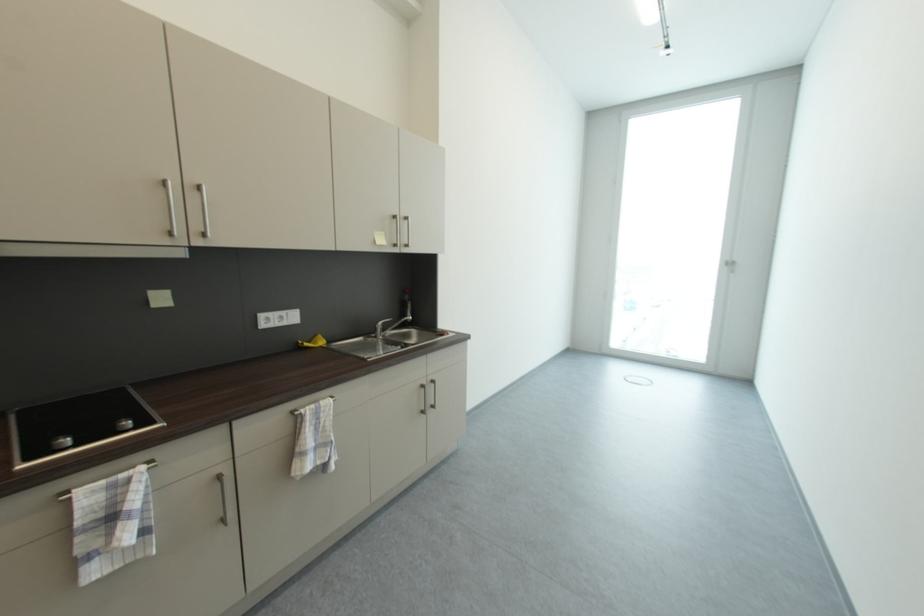
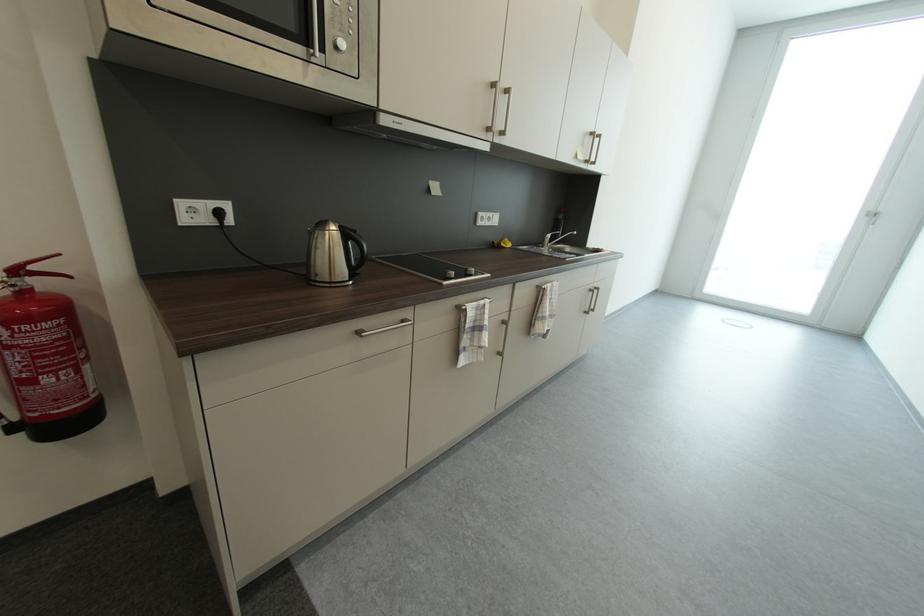
Locate, in the second image, the point that corresponds to (x=736, y=265) in the first image.

(878, 217)